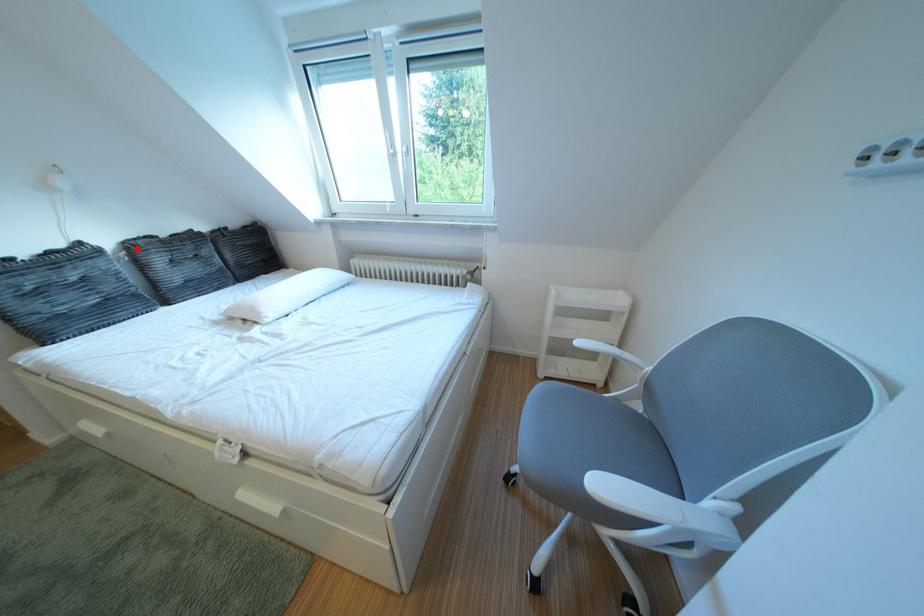
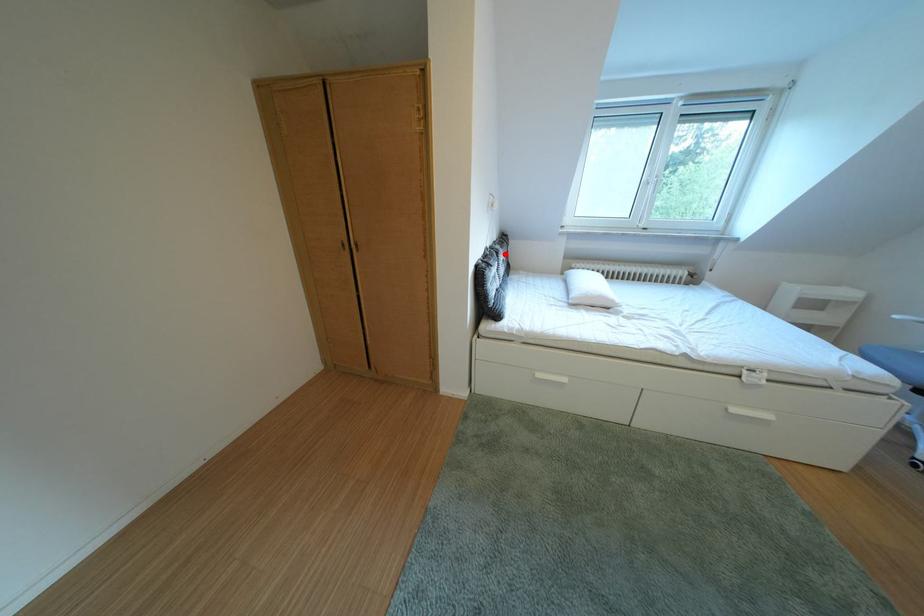
I am providing you with two images of the same scene from different viewpoints. A red point is marked on the first image and another point is marked on the second image. Do the highlighted points in image1 and image2 indicate the same real-world spot?

Yes